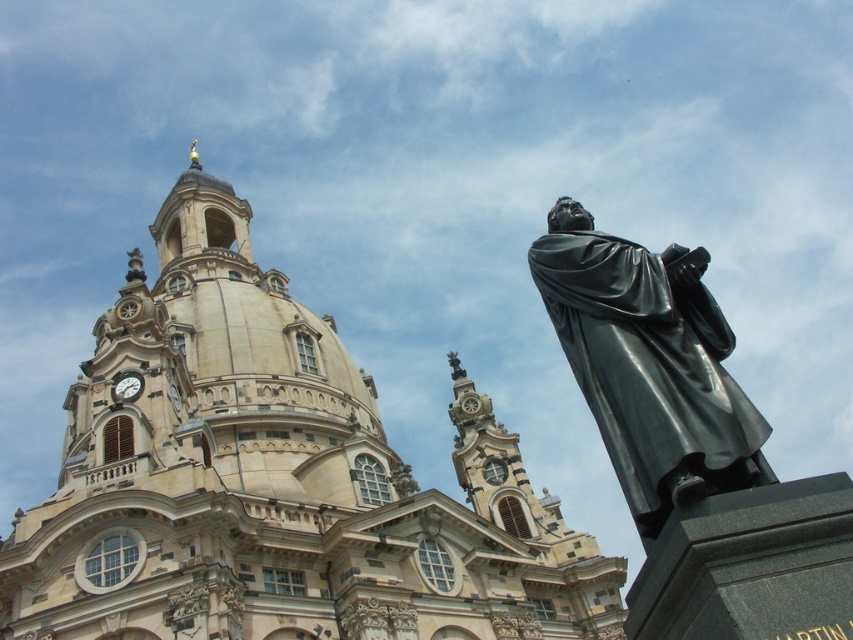
Which is more to the left, beige stone church at center or black polished statue at right?

Positioned to the left is beige stone church at center.

Can you confirm if beige stone church at center is wider than black polished statue at right?

Yes, beige stone church at center is wider than black polished statue at right.

Identify the location of beige stone church at center. (274, 480).